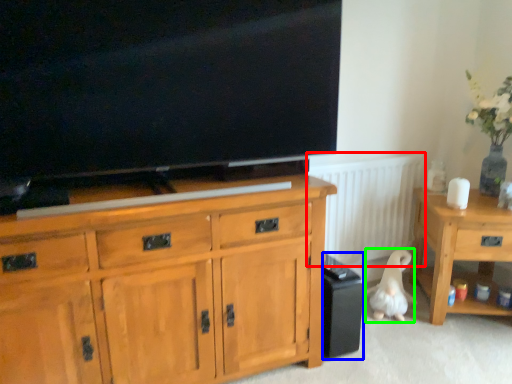
Question: Which object is positioned closest to radiator (highlighted by a red box)? Select from loudspeaker (highlighted by a blue box) and animal (highlighted by a green box).

Choices:
 (A) loudspeaker
 (B) animal

Answer: (B)